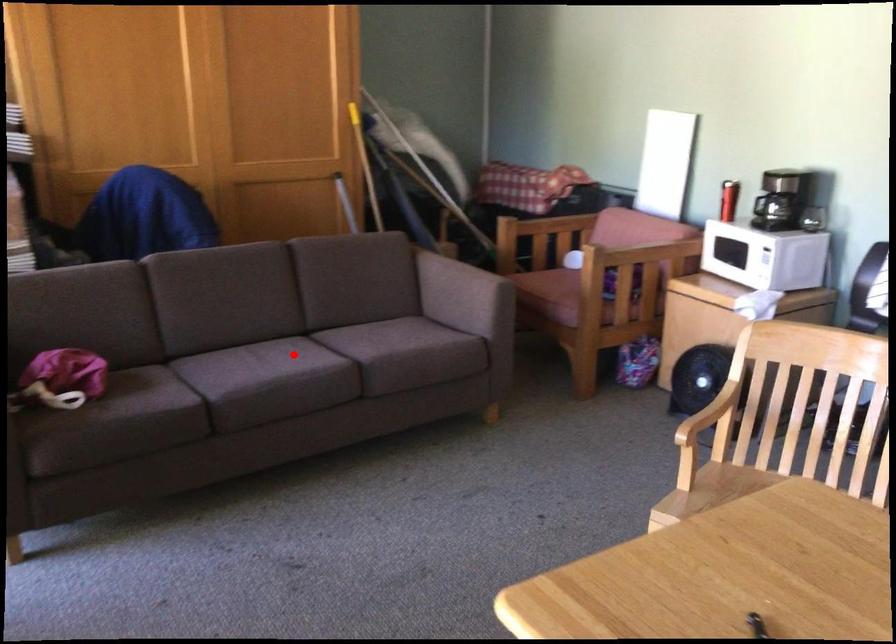
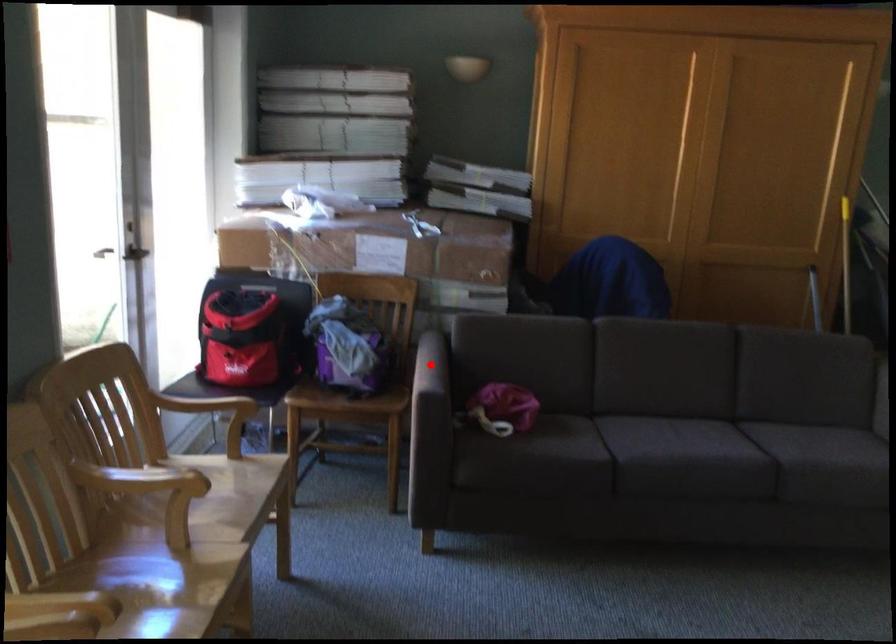
I am providing you with two images of the same scene from different viewpoints. A red point is marked on the first image and another point is marked on the second image. Is the red point in image1 aligned with the point shown in image2?

No